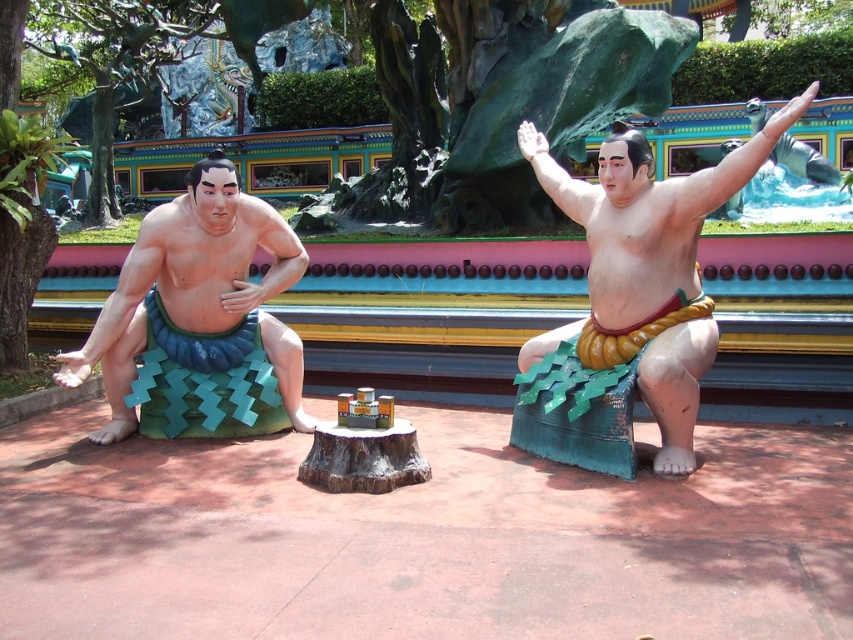
What do you see at coordinates (198, 308) in the screenshot?
I see `matte green fabric at left` at bounding box center [198, 308].

Is matte green fabric at left smaller than matte green fabric at center?

Yes.

This screenshot has height=640, width=853. Identify the location of matte green fabric at left. (198, 308).